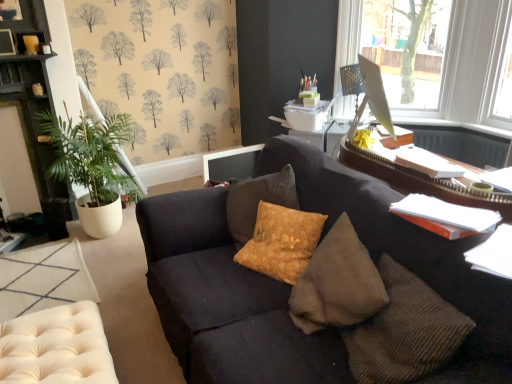
Describe the element at coordinates (225, 301) in the screenshot. I see `dark gray fabric couch at center` at that location.

In order to click on dark wood cabinet at left in this screenshot , I will do `click(34, 110)`.

I want to click on dark gray fabric couch at center, so click(x=225, y=301).

In the image, is beige tufted ottoman at lower left positioned in front of or behind dark wood cabinet at left?

beige tufted ottoman at lower left is in front of dark wood cabinet at left.

Is beige tufted ottoman at lower left facing towards dark wood cabinet at left?

No, beige tufted ottoman at lower left is not facing towards dark wood cabinet at left.

From a real-world perspective, is beige tufted ottoman at lower left physically located above or below dark wood cabinet at left?

Clearly, from a real-world perspective, beige tufted ottoman at lower left is below dark wood cabinet at left.

Would you say beige tufted ottoman at lower left is a long distance from dark wood cabinet at left?

Actually, beige tufted ottoman at lower left and dark wood cabinet at left are a little close together.

From the image's perspective, between green leafy plant at left and matte cream tufted swivel chair at lower left, who is located below?

matte cream tufted swivel chair at lower left is shown below in the image.

Considering the relative sizes of green leafy plant at left and matte cream tufted swivel chair at lower left in the image provided, is green leafy plant at left smaller than matte cream tufted swivel chair at lower left?

Actually, green leafy plant at left might be larger than matte cream tufted swivel chair at lower left.

Looking at their sizes, would you say green leafy plant at left is wider or thinner than matte cream tufted swivel chair at lower left?

green leafy plant at left is wider than matte cream tufted swivel chair at lower left.

Looking at this image, is green leafy plant at left turned away from matte cream tufted swivel chair at lower left?

No, matte cream tufted swivel chair at lower left is not at the back of green leafy plant at left.

Do you think suede textured pillow at center is within metallic mesh table lamp at upper right, or outside of it?

suede textured pillow at center is located beyond the bounds of metallic mesh table lamp at upper right.

Is suede textured pillow at center bigger than metallic mesh table lamp at upper right?

Yes.

From a real-world perspective, is suede textured pillow at center physically located above or below metallic mesh table lamp at upper right?

From a real-world perspective, suede textured pillow at center is physically below metallic mesh table lamp at upper right.

Who is more distant, suede textured pillow at center or metallic mesh table lamp at upper right?

metallic mesh table lamp at upper right is further from the camera.

Would you consider metallic mesh table lamp at upper right to be distant from matte cream tufted swivel chair at lower left?

Yes, metallic mesh table lamp at upper right and matte cream tufted swivel chair at lower left are quite far apart.

Is metallic mesh table lamp at upper right shorter than matte cream tufted swivel chair at lower left?

No, metallic mesh table lamp at upper right is not shorter than matte cream tufted swivel chair at lower left.

Identify the location of swivel chair lying in front of the metallic mesh table lamp at upper right. The width and height of the screenshot is (512, 384). (56, 347).

From a real-world perspective, who is located higher, transparent glass monitor at upper right or dark gray fabric couch at center?

In real-world perspective, transparent glass monitor at upper right is above.

From the picture: From their relative heights in the image, would you say transparent glass monitor at upper right is taller or shorter than dark gray fabric couch at center?

transparent glass monitor at upper right is taller than dark gray fabric couch at center.

Do you think transparent glass monitor at upper right is within dark gray fabric couch at center, or outside of it?

transparent glass monitor at upper right exists outside the volume of dark gray fabric couch at center.

Is transparent glass monitor at upper right outside of beige tufted ottoman at lower left?

Yes, transparent glass monitor at upper right is located beyond the bounds of beige tufted ottoman at lower left.

Which object is further away from the camera, transparent glass monitor at upper right or beige tufted ottoman at lower left?

transparent glass monitor at upper right is more distant.

Could you tell me if transparent glass monitor at upper right is facing beige tufted ottoman at lower left?

No, transparent glass monitor at upper right is not facing towards beige tufted ottoman at lower left.

Considering the sizes of objects transparent glass monitor at upper right and beige tufted ottoman at lower left in the image provided, who is wider, transparent glass monitor at upper right or beige tufted ottoman at lower left?

Wider between the two is beige tufted ottoman at lower left.

Is point (469, 298) closer to viewer compared to point (93, 205)?

Yes.

Is dark gray fabric couch at center taller than green leafy plant at left?

No, dark gray fabric couch at center is not taller than green leafy plant at left.

The height and width of the screenshot is (384, 512). In order to click on houseplant lying above the dark gray fabric couch at center (from the image's perspective) in this screenshot , I will do `click(92, 167)`.

Considering the sizes of objects dark gray fabric couch at center and green leafy plant at left in the image provided, who is bigger, dark gray fabric couch at center or green leafy plant at left?

dark gray fabric couch at center is bigger.

This screenshot has width=512, height=384. In order to click on footrest below the dark wood cabinet at left (from the image's perspective) in this screenshot , I will do `click(44, 279)`.

Find the location of `swivel chair in front of the green leafy plant at left`. swivel chair in front of the green leafy plant at left is located at coordinates (56, 347).

When comparing their distances from dark gray fabric couch at center, does green leafy plant at left or suede textured pillow at center seem further?

green leafy plant at left.

In the scene shown: From the image, which object appears to be farther from dark wood cabinet at left, transparent glass monitor at upper right or green leafy plant at left?

transparent glass monitor at upper right is positioned further to the anchor dark wood cabinet at left.

Which object lies nearer to the anchor point dark gray fabric couch at center, matte cream tufted swivel chair at lower left or suede textured pillow at center?

suede textured pillow at center is closer to dark gray fabric couch at center.

Considering their positions, is suede textured pillow at center positioned closer to green leafy plant at left than dark wood cabinet at left?

The object closer to green leafy plant at left is dark wood cabinet at left.

Estimate the real-world distances between objects in this image. Which object is further from dark wood cabinet at left, green leafy plant at left or dark gray fabric couch at center?

Based on the image, dark gray fabric couch at center appears to be further to dark wood cabinet at left.

When comparing their distances from metallic mesh table lamp at upper right, does suede textured pillow at center or matte cream tufted swivel chair at lower left seem further?

matte cream tufted swivel chair at lower left is positioned further to the anchor metallic mesh table lamp at upper right.

Looking at the image, which one is located closer to transparent glass monitor at upper right, beige tufted ottoman at lower left or dark wood cabinet at left?

dark wood cabinet at left.

From the picture: When comparing their distances from metallic mesh table lamp at upper right, does beige tufted ottoman at lower left or transparent glass monitor at upper right seem further?

beige tufted ottoman at lower left is positioned further to the anchor metallic mesh table lamp at upper right.

You are a GUI agent. You are given a task and a screenshot of the screen. Output one action in this format:
    pyautogui.click(x=<x>, y=<y>)
    Task: Click on the footrest positioned between dark gray fabric couch at center and metallic mesh table lamp at upper right from near to far
    The image size is (512, 384).
    Given the screenshot: What is the action you would take?
    pyautogui.click(x=44, y=279)

Where is `swivel chair between beige tufted ottoman at lower left and transparent glass monitor at upper right`? The width and height of the screenshot is (512, 384). swivel chair between beige tufted ottoman at lower left and transparent glass monitor at upper right is located at coordinates (56, 347).

Locate an element on the screen. studio couch located between green leafy plant at left and suede textured pillow at center in the left-right direction is located at coordinates (225, 301).

Where is `the footrest located between dark wood cabinet at left and suede textured pillow at center in the left-right direction`? The image size is (512, 384). the footrest located between dark wood cabinet at left and suede textured pillow at center in the left-right direction is located at coordinates (44, 279).